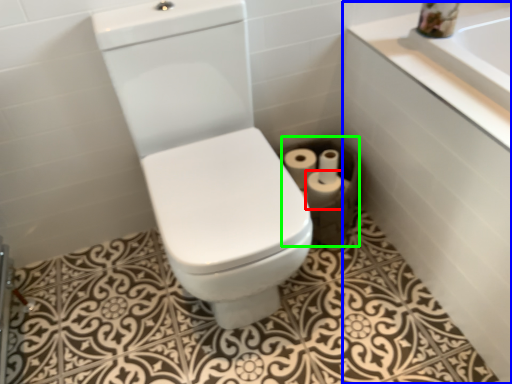
Question: Based on their relative distances, which object is farther from toilet paper (highlighted by a red box)? Choose from bath (highlighted by a blue box) and toilet paper (highlighted by a green box).

Choices:
 (A) bath
 (B) toilet paper

Answer: (A)